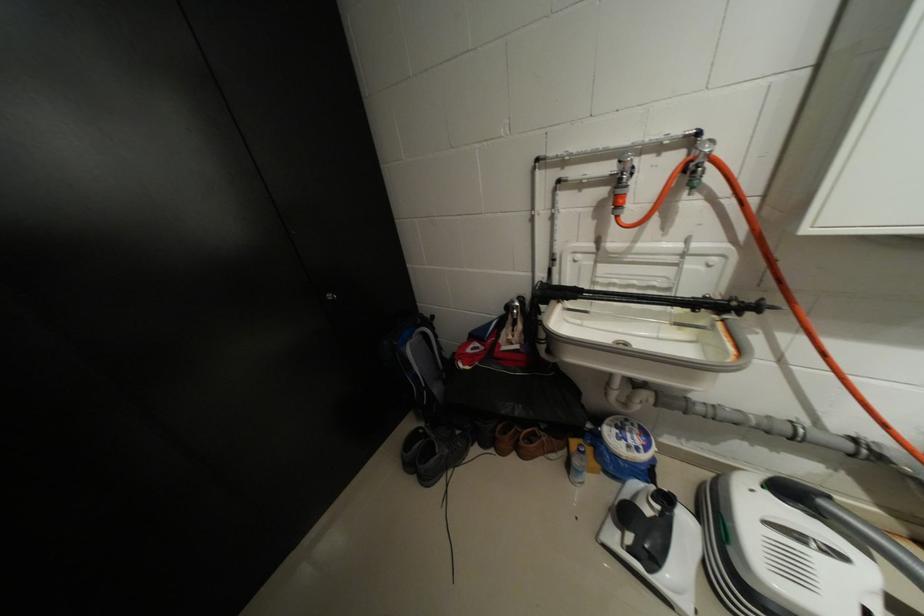
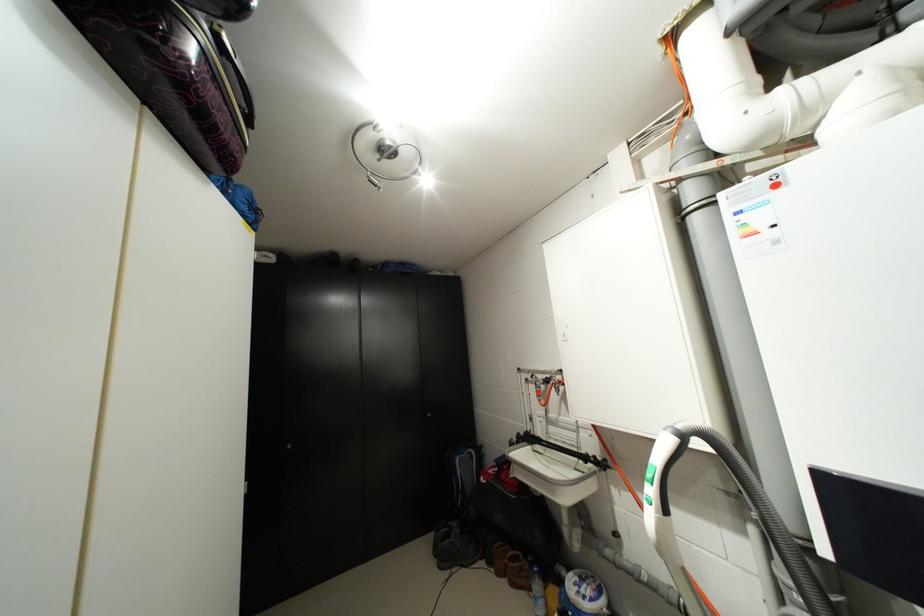
The point at (652, 448) is marked in the first image. Where is the corresponding point in the second image?

(599, 600)